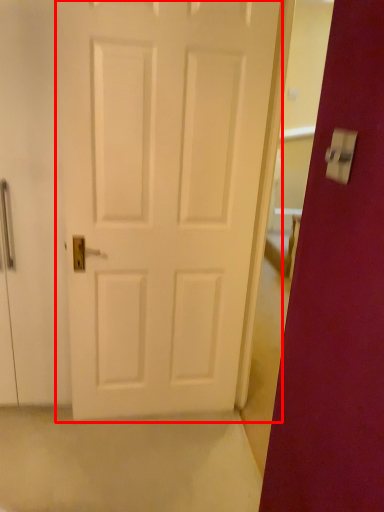
Question: From the image's perspective, considering the relative positions of door (annotated by the red box) and light switch in the image provided, where is door (annotated by the red box) located with respect to the staircase?

Choices:
 (A) below
 (B) above

Answer: (A)